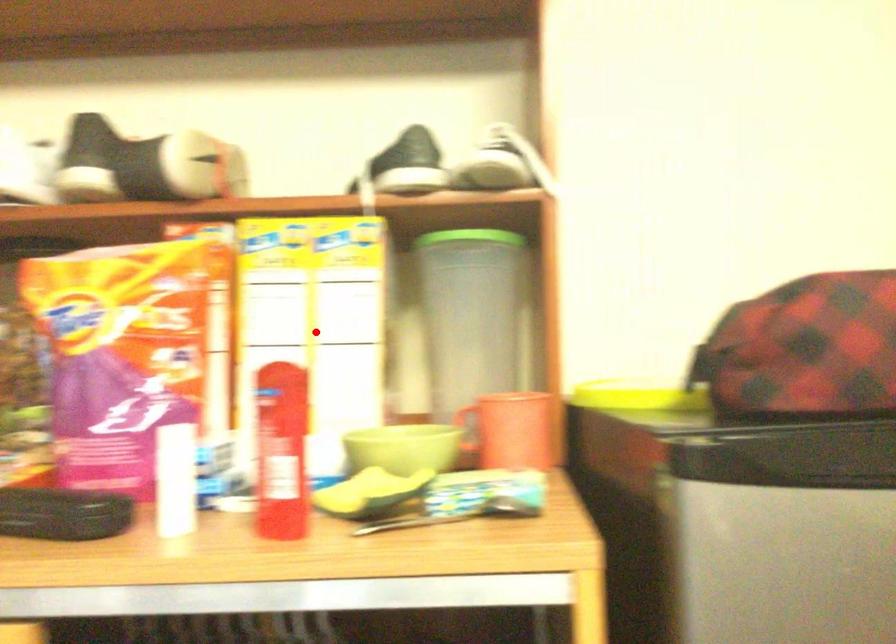
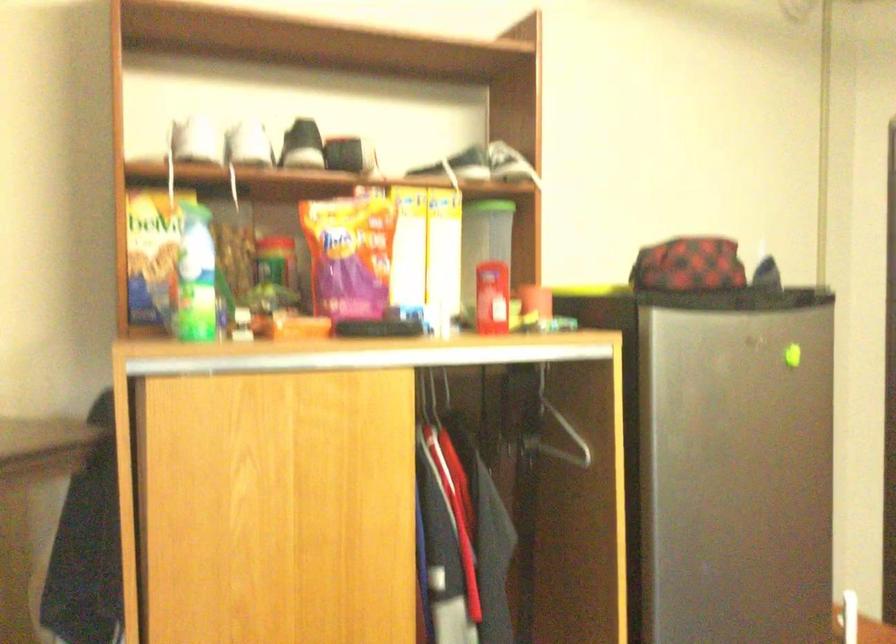
Find the pixel in the second image that matches the highlighted location in the first image.

(426, 251)